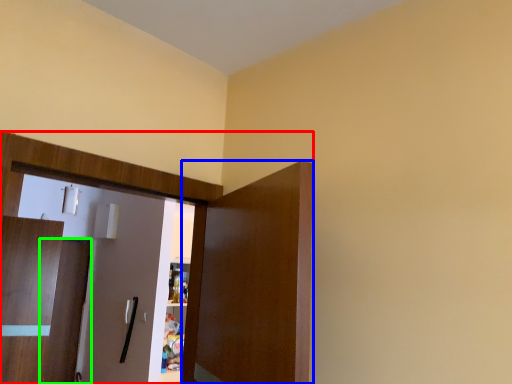
Question: Which is farther away from dresser (highlighted by a red box)? door (highlighted by a blue box) or door (highlighted by a green box)?

Choices:
 (A) door
 (B) door

Answer: (B)